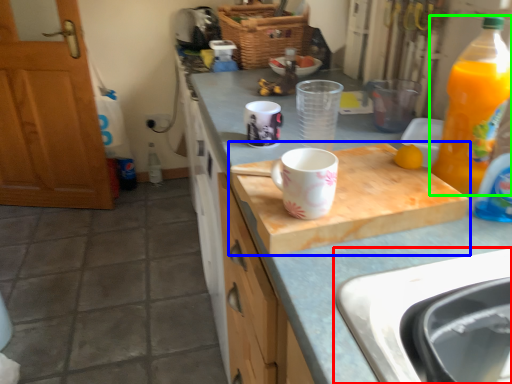
Question: Based on their relative distances, which object is farther from sink (highlighted by a red box)? Choose from cutting board (highlighted by a blue box) and bottle (highlighted by a green box).

Choices:
 (A) cutting board
 (B) bottle

Answer: (B)